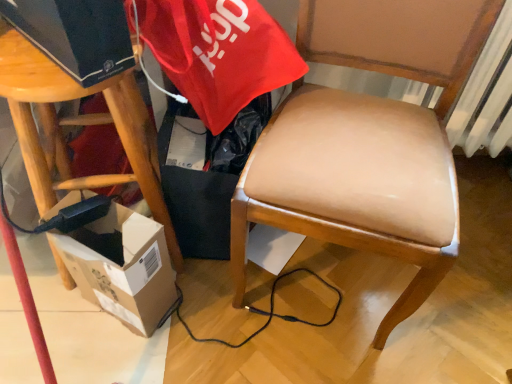
Question: Should I look upward or downward to see leather-like tan chair at center?

Choices:
 (A) down
 (B) up

Answer: (B)

Question: Can you confirm if cardboard box at lower left is shorter than wooden stool at left?

Choices:
 (A) no
 (B) yes

Answer: (B)

Question: Is cardboard box at lower left closer to camera compared to wooden stool at left?

Choices:
 (A) yes
 (B) no

Answer: (B)

Question: Is cardboard box at lower left looking in the opposite direction of wooden stool at left?

Choices:
 (A) no
 (B) yes

Answer: (B)

Question: Is wooden stool at left a part of cardboard box at lower left?

Choices:
 (A) yes
 (B) no

Answer: (B)

Question: Is there a large distance between cardboard box at lower left and wooden stool at left?

Choices:
 (A) no
 (B) yes

Answer: (A)

Question: Considering the relative sizes of cardboard box at lower left and wooden stool at left in the image provided, is cardboard box at lower left bigger than wooden stool at left?

Choices:
 (A) yes
 (B) no

Answer: (B)

Question: Can you confirm if leather-like tan chair at center is positioned to the right of cardboard box at lower left?

Choices:
 (A) no
 (B) yes

Answer: (B)

Question: From a real-world perspective, is leather-like tan chair at center positioned over cardboard box at lower left based on gravity?

Choices:
 (A) no
 (B) yes

Answer: (B)

Question: Is leather-like tan chair at center thinner than cardboard box at lower left?

Choices:
 (A) no
 (B) yes

Answer: (A)

Question: Can you confirm if leather-like tan chair at center is wider than cardboard box at lower left?

Choices:
 (A) no
 (B) yes

Answer: (B)

Question: Is leather-like tan chair at center oriented away from cardboard box at lower left?

Choices:
 (A) no
 (B) yes

Answer: (A)

Question: Is leather-like tan chair at center completely or partially outside of cardboard box at lower left?

Choices:
 (A) no
 (B) yes

Answer: (B)

Question: Is wooden stool at left surrounding cardboard box at lower left?

Choices:
 (A) yes
 (B) no

Answer: (A)